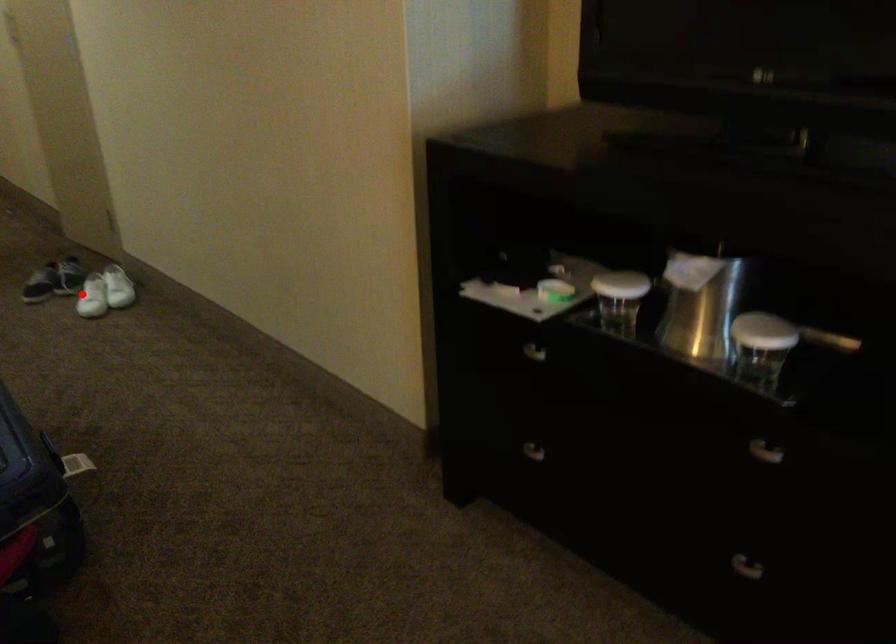
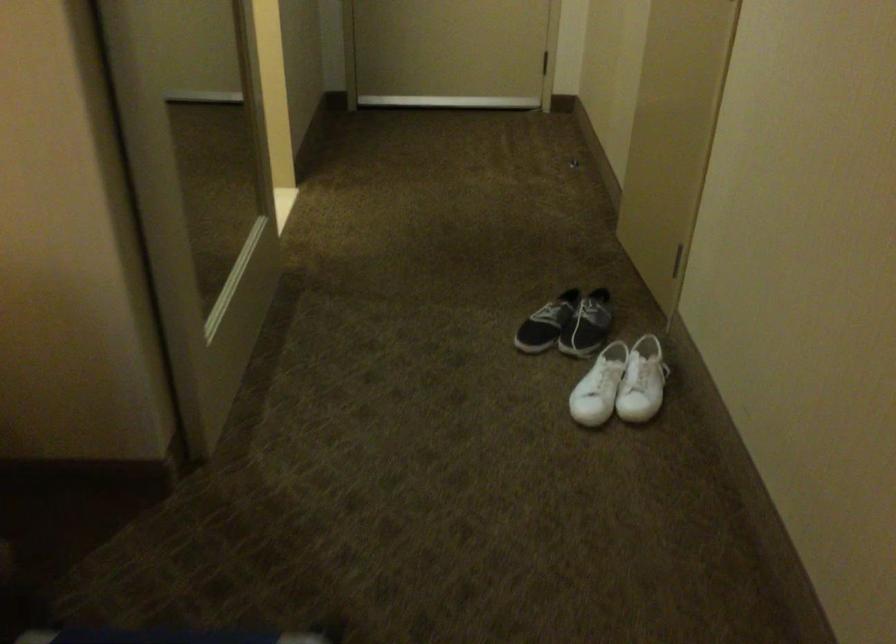
Locate, in the second image, the point that corresponds to the highlighted location in the first image.

(599, 386)